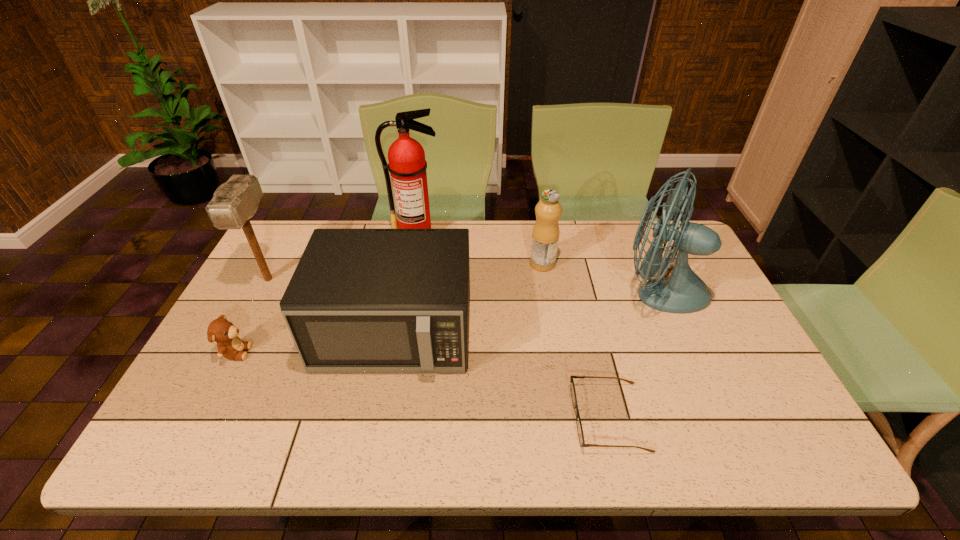
The image size is (960, 540). Find the location of `free space located 0.400m in front of the fan to blow air`. free space located 0.400m in front of the fan to blow air is located at coordinates (481, 291).

Locate an element on the screen. The width and height of the screenshot is (960, 540). blank space located 0.070m in front of the fan to blow air is located at coordinates (590, 291).

This screenshot has width=960, height=540. I want to click on vacant space located 0.080m on the striking face of the mallet, so click(x=249, y=317).

Find the location of a particular element. free space located 0.310m on the front label of the fruit juice is located at coordinates click(434, 264).

Find the location of a particular element. The image size is (960, 540). vacant space located 0.130m on the front label of the fruit juice is located at coordinates (490, 264).

Identify the location of free region located 0.350m on the front label of the fruit juice. 421,264.

Locate an element on the screen. This screenshot has height=540, width=960. vacant area situated on the front-facing side of the microwave oven is located at coordinates (380, 409).

Identify the location of free location located 0.300m on the face of the second shortest object. point(365,353).

This screenshot has width=960, height=540. Find the location of `free spot located on the front-facing side of the nearest object`. free spot located on the front-facing side of the nearest object is located at coordinates (462, 417).

Locate an element on the screen. This screenshot has width=960, height=540. free point located 0.200m on the front-facing side of the nearest object is located at coordinates (488, 417).